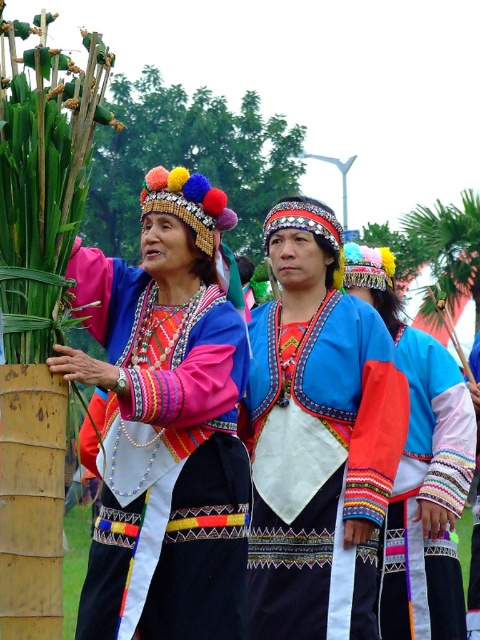
Question: Which point is closer to the camera?

Choices:
 (A) 123,632
 (B) 324,518
 (C) 435,568

Answer: (A)

Question: Does blue satin blouse at center come behind multicolored woven fabric at center?

Choices:
 (A) yes
 (B) no

Answer: (B)

Question: Is matte black dress at center thinner than blue satin blouse at center?

Choices:
 (A) no
 (B) yes

Answer: (B)

Question: Does blue satin blouse at center appear under multicolored woven fabric at center?

Choices:
 (A) no
 (B) yes

Answer: (B)

Question: Which point is closer to the camera?

Choices:
 (A) multicolored woven fabric at center
 (B) blue satin blouse at center
 (C) matte black dress at center

Answer: (C)

Question: Which point is farther to the camera?

Choices:
 (A) (344, 404)
 (B) (228, 612)

Answer: (A)